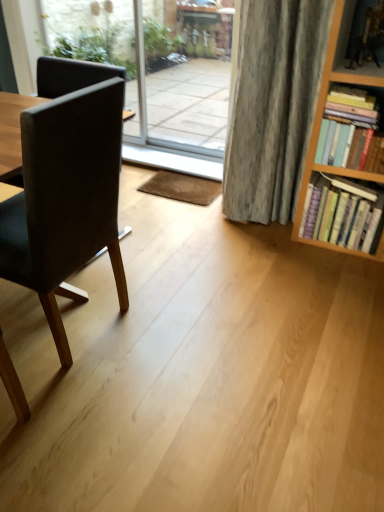
Find the location of a particular element. Image resolution: width=384 pixels, height=512 pixels. free region on the left part of hardcover books at right, arranged as the second book when viewed from the top is located at coordinates (285, 243).